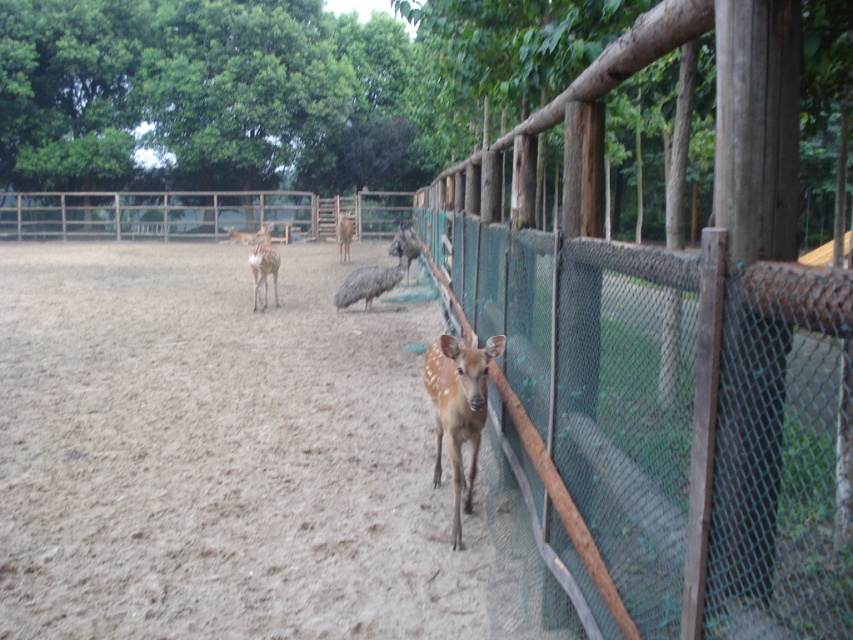
You are a zookeeper who needs to distribute food to the animals in the enclosure. The food requires a flat area larger than the brown speckled fur at center. Is there enough space on the brown sandy dirt at center to place the food?

The brown sandy dirt at center has a width larger than the brown speckled fur at center, so yes, there is enough space on the brown sandy dirt at center to place the food.

You are a zookeeper planning to feed the animals in the enclosure. You need to ensure that the green mesh fence at center and the brown glossy deer at center are visible to visitors from the observation deck. Considering their heights, which one is more likely to be seen over the other?

The brown glossy deer at center is taller than the green mesh fence at center, so visitors will be able to see the deer over the fence.